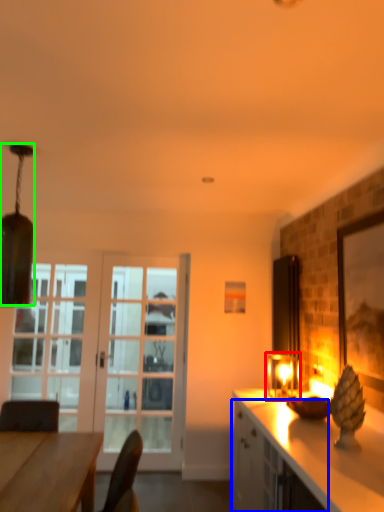
Question: Estimate the real-world distances between objects in this image. Which object is farther from light fixture (highlighted by a red box), cabinetry (highlighted by a blue box) or lamp (highlighted by a green box)?

Choices:
 (A) cabinetry
 (B) lamp

Answer: (B)